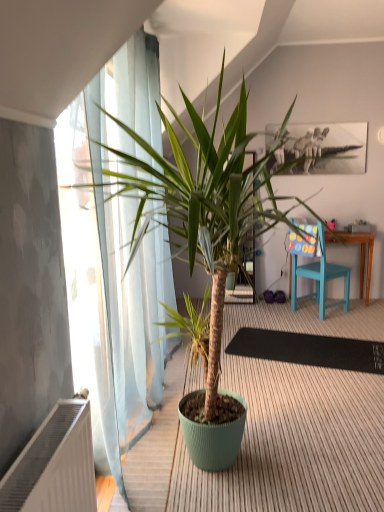
Question: Is white plastic radiator at lower left turned away from green matte plant pot at center?

Choices:
 (A) yes
 (B) no

Answer: (B)

Question: Considering the relative sizes of white plastic radiator at lower left and green matte plant pot at center in the image provided, is white plastic radiator at lower left bigger than green matte plant pot at center?

Choices:
 (A) yes
 (B) no

Answer: (B)

Question: Is white plastic radiator at lower left next to green matte plant pot at center and touching it?

Choices:
 (A) yes
 (B) no

Answer: (B)

Question: Is white plastic radiator at lower left positioned behind green matte plant pot at center?

Choices:
 (A) yes
 (B) no

Answer: (B)

Question: From the image's perspective, is white plastic radiator at lower left beneath green matte plant pot at center?

Choices:
 (A) yes
 (B) no

Answer: (A)

Question: Is point (54, 460) positioned closer to the camera than point (327, 354)?

Choices:
 (A) farther
 (B) closer

Answer: (B)

Question: Considering the positions of white plastic radiator at lower left and black rubber mat at center in the image, is white plastic radiator at lower left taller or shorter than black rubber mat at center?

Choices:
 (A) tall
 (B) short

Answer: (A)

Question: Would you say white plastic radiator at lower left is inside or outside black rubber mat at center?

Choices:
 (A) inside
 (B) outside

Answer: (B)

Question: Would you say white plastic radiator at lower left is to the left or to the right of black rubber mat at center in the picture?

Choices:
 (A) right
 (B) left

Answer: (B)

Question: In the image, is green matte plant pot at center on the left side or the right side of teal wood chair at right?

Choices:
 (A) left
 (B) right

Answer: (A)

Question: Is green matte plant pot at center wider or thinner than teal wood chair at right?

Choices:
 (A) wide
 (B) thin

Answer: (A)

Question: Is green matte plant pot at center situated inside teal wood chair at right or outside?

Choices:
 (A) inside
 (B) outside

Answer: (B)

Question: Is green matte plant pot at center in front of or behind teal wood chair at right in the image?

Choices:
 (A) front
 (B) behind

Answer: (A)

Question: From a real-world perspective, is green matte plant pot at center positioned above or below white plastic radiator at lower left?

Choices:
 (A) below
 (B) above

Answer: (B)

Question: From the image's perspective, relative to white plastic radiator at lower left, is green matte plant pot at center above or below?

Choices:
 (A) above
 (B) below

Answer: (A)